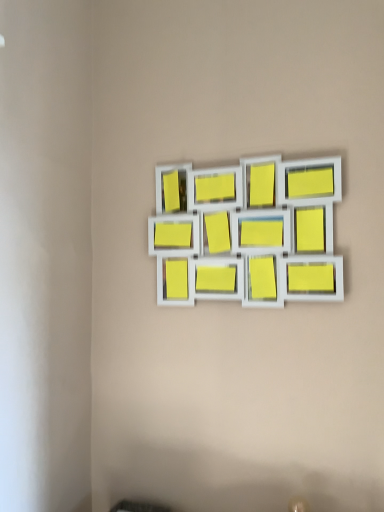
Image resolution: width=384 pixels, height=512 pixels. Describe the element at coordinates (250, 233) in the screenshot. I see `white matte picture frame at center` at that location.

What is the approximate height of white matte picture frame at center?

It is 18.74 inches.

Find the location of a particular element. The height and width of the screenshot is (512, 384). white matte picture frame at center is located at coordinates (250, 233).

The height and width of the screenshot is (512, 384). I want to click on white matte picture frame at center, so click(x=250, y=233).